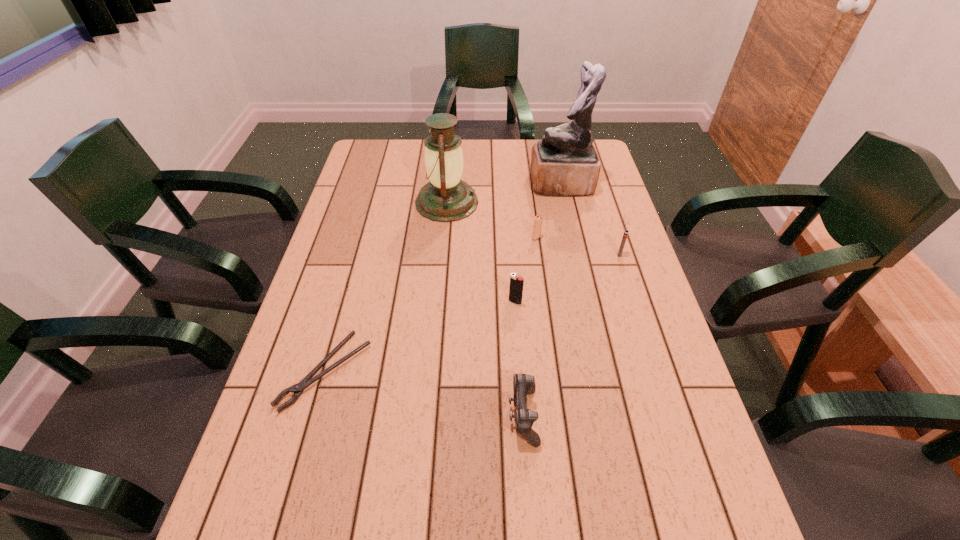
The image size is (960, 540). I want to click on the shortest object, so click(297, 389).

Image resolution: width=960 pixels, height=540 pixels. Identify the location of the leftmost object. (297, 389).

Identify the location of vacant space located in a relaxed pose on the tallest object. The height and width of the screenshot is (540, 960). (441, 184).

Identify the location of vacant space located 0.320m in a relaxed pose on the tallest object. This screenshot has height=540, width=960. click(x=438, y=184).

The image size is (960, 540). What are the coordinates of `vacant space located in a relaxed pose on the tallest object` in the screenshot? It's located at (467, 184).

Locate an element on the screen. vacant space situated with the light compartment facing forward on the lantern is located at coordinates (500, 202).

You are a GUI agent. You are given a task and a screenshot of the screen. Output one action in this format:
    pyautogui.click(x=<x>, y=<y>)
    Task: Click on the vacant point located 0.230m on the back of the leftmost igniter
    This screenshot has height=540, width=960.
    Given the screenshot: What is the action you would take?
    pyautogui.click(x=511, y=241)

The width and height of the screenshot is (960, 540). I want to click on vacant region located 0.220m on the surface of the control with buttons, so click(403, 416).

Locate an element on the screen. The width and height of the screenshot is (960, 540). vacant area located 0.120m on the surface of the control with buttons is located at coordinates [451, 416].

Locate an element on the screen. free space located on the surface of the control with buttons is located at coordinates (384, 416).